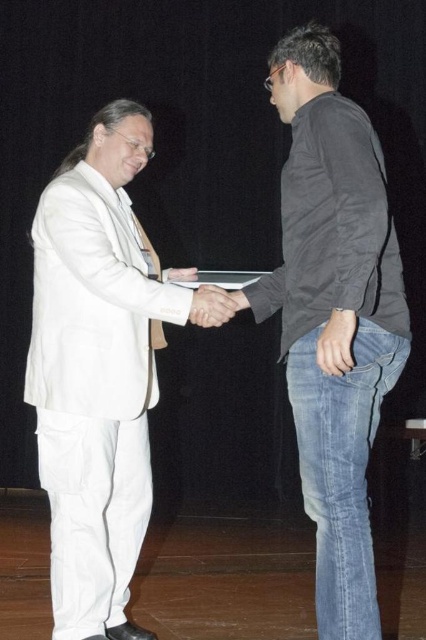
Question: Which object is the closest to the white matte suit at left?

Choices:
 (A) dark gray cotton shirt at center
 (B) matte black hand at center
 (C) white matte hand at center

Answer: (C)

Question: Can you confirm if matte black hand at center is smaller than white matte hand at center?

Choices:
 (A) no
 (B) yes

Answer: (B)

Question: Which of the following is the closest to the observer?

Choices:
 (A) (46, 243)
 (B) (284, 108)
 (C) (203, 301)
 (D) (333, 317)

Answer: (D)

Question: Can you confirm if dark gray cotton shirt at center is thinner than matte black hand at center?

Choices:
 (A) no
 (B) yes

Answer: (A)

Question: Which of the following is the closest to the observer?

Choices:
 (A) white matte suit at left
 (B) dark gray cotton shirt at center

Answer: (B)

Question: Is white matte suit at left to the left of white matte hand at center from the viewer's perspective?

Choices:
 (A) yes
 (B) no

Answer: (A)